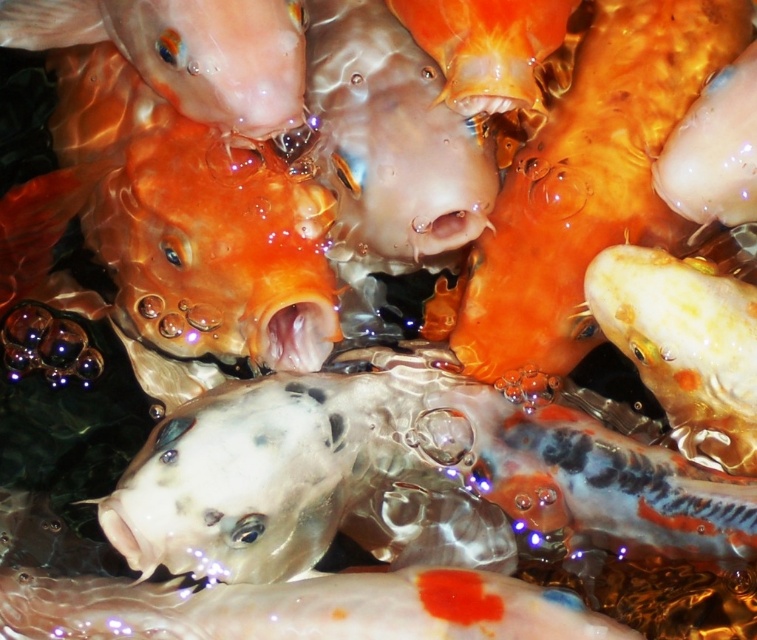
You are a photographer trying to capture the shiny white fish at bottom in your shot. Based on its position, where should you aim your camera?

The shiny white fish at bottom is located at point 0.952 on the x axis and 0.398 on the y axis. To capture it, aim your camera towards the bottom right corner of the scene, slightly towards the center on the y axis.

Based on the photo, you are a diver swimming in the water and see two points in the distance. You want to reach the point that is closer to you first. Which point should you swim towards first, the point at (706,346) or the point at (712,195)?

You should swim towards the point at (706,346) first because it is in front of the point at (712,195), making it closer to you.

You are a photographer trying to capture a clear image of the matte orange fish at upper left and the orange glossy goldfish at upper center. Since the water is slightly rippled, which fish might be harder to focus on due to its position relative to the other?

The matte orange fish at upper left is positioned under the orange glossy goldfish at upper center. Since it is located beneath the goldfish, it might be harder to focus on due to the overlapping and the ripples in the water causing distortion.